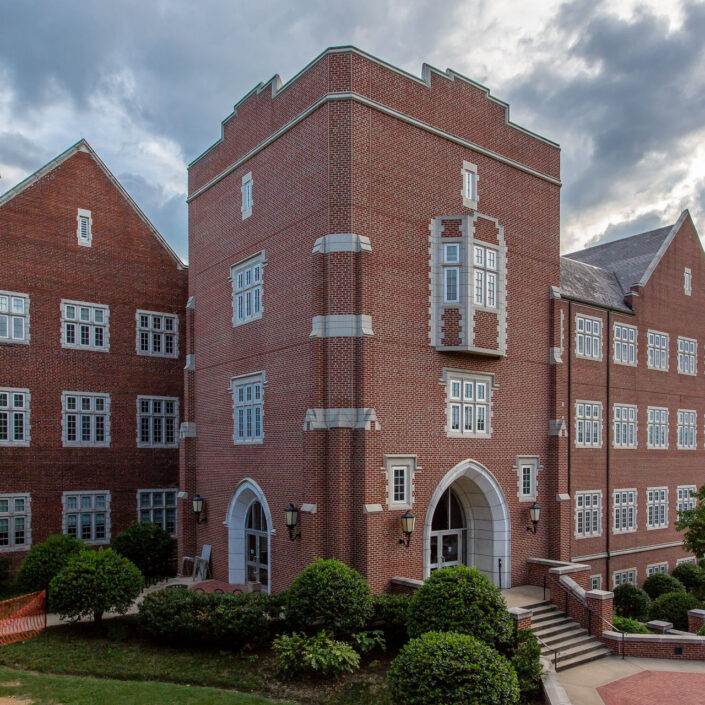
Where is `doors`? The width and height of the screenshot is (705, 705). doors is located at coordinates (254, 556), (447, 553).